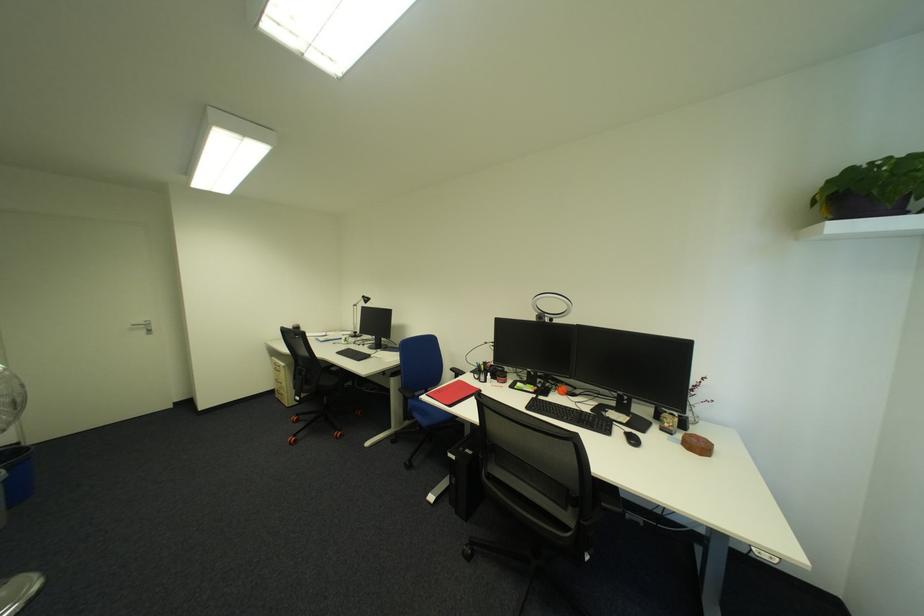
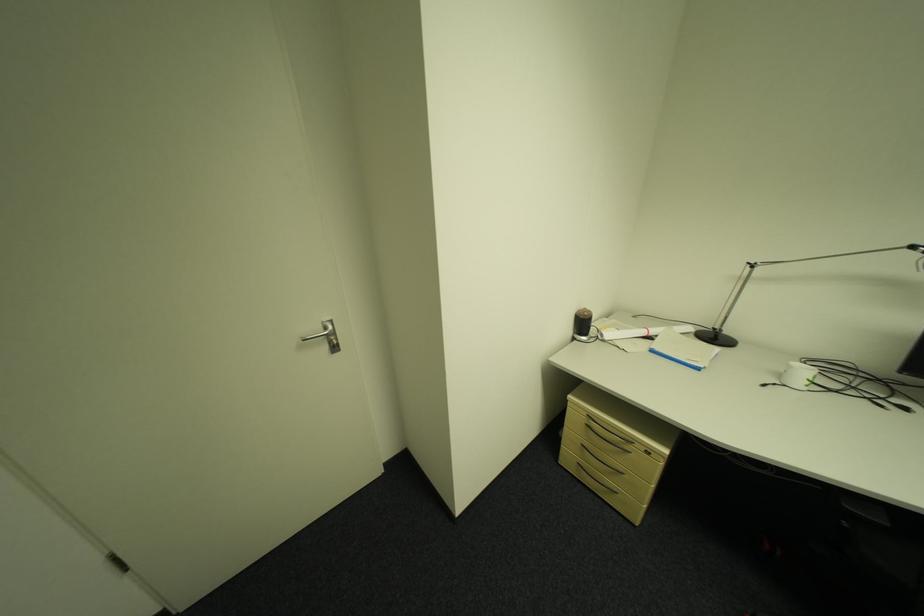
Consider the image. Which direction would the cameraman need to move to produce the second image?

The cameraman walked toward left, forward.